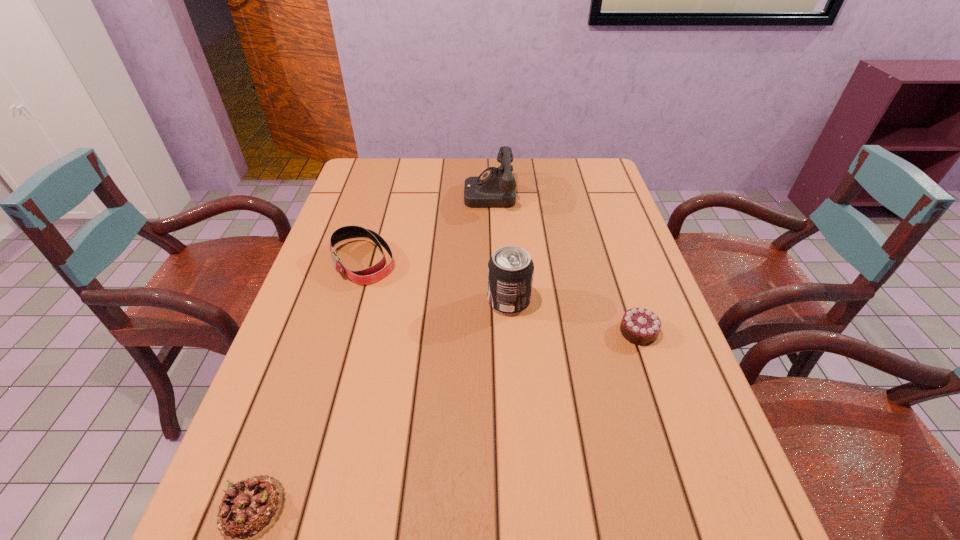
Where is `vacant point located between the third shortest object and the farthest object`? This screenshot has height=540, width=960. vacant point located between the third shortest object and the farthest object is located at coordinates (425, 227).

Identify the location of blank region between the farthest object and the soda can. (499, 247).

Where is `empty space that is in between the soda can and the telephone`? The height and width of the screenshot is (540, 960). empty space that is in between the soda can and the telephone is located at coordinates (499, 247).

You are a GUI agent. You are given a task and a screenshot of the screen. Output one action in this format:
    pyautogui.click(x=<x>, y=<y>)
    Task: Click on the vacant area that lies between the farthest object and the fourth farthest object
    The width and height of the screenshot is (960, 540).
    Given the screenshot: What is the action you would take?
    pyautogui.click(x=564, y=262)

Locate an element on the screen. blank region between the second nearest object and the farthest object is located at coordinates (564, 262).

Where is `empty space that is in between the telephone and the third shortest object`? empty space that is in between the telephone and the third shortest object is located at coordinates (425, 227).

Choose which object is the second nearest neighbor to the left chocolate cake. Please provide its 2D coordinates. Your answer should be formatted as a tuple, i.e. [(x, y)], where the tuple contains the x and y coordinates of a point satisfying the conditions above.

[(510, 270)]

Identify which object is the third nearest to the soda can. Please provide its 2D coordinates. Your answer should be formatted as a tuple, i.e. [(x, y)], where the tuple contains the x and y coordinates of a point satisfying the conditions above.

[(495, 187)]

Locate an element on the screen. The width and height of the screenshot is (960, 540). vacant point that satisfies the following two spatial constraints: 1. on the front side of the dog collar; 2. on the right side of the soda can is located at coordinates (350, 301).